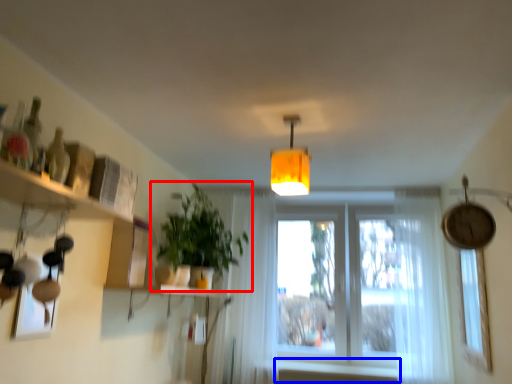
Question: Which point is closer to the camera, houseplant (highlighted by a red box) or window sill (highlighted by a blue box)?

Choices:
 (A) houseplant
 (B) window sill

Answer: (A)